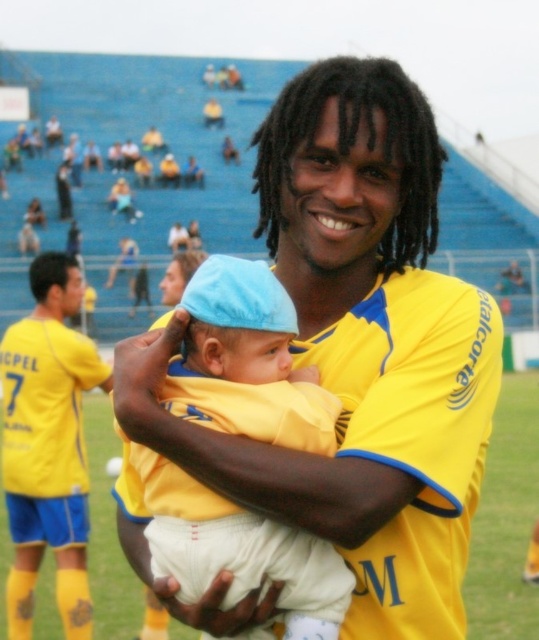
You are a photographer standing at the edge of the soccer field. You need to take a photo that includes both the yellow jersey at center and the yellow jersey at left. Which direction should you move to ensure both are in frame?

You should move to the left to ensure both the yellow jersey at center and the yellow jersey at left are in frame since the yellow jersey at center is to the right of the yellow jersey at left.

You are a photographer at the soccer field. You need to take a photo that includes both the yellow jersey at center and the yellow jersey at left. Which jersey should you focus on first to ensure both are in the frame?

The yellow jersey at center is shorter than the yellow jersey at left. Therefore, you should focus on the yellow jersey at left first since it is taller and will be easier to frame both in the photo.

You are a photographer trying to capture the baby in the yellow outfit clearly. The light blue fabric hat at center and the yellow fabric baby at center are in your viewfinder. Which object should you focus on to ensure the baby is sharp?

The light blue fabric hat at center is in front of the yellow fabric baby at center. To ensure the baby is sharp, focus on the yellow fabric baby at center since it is behind the hat.